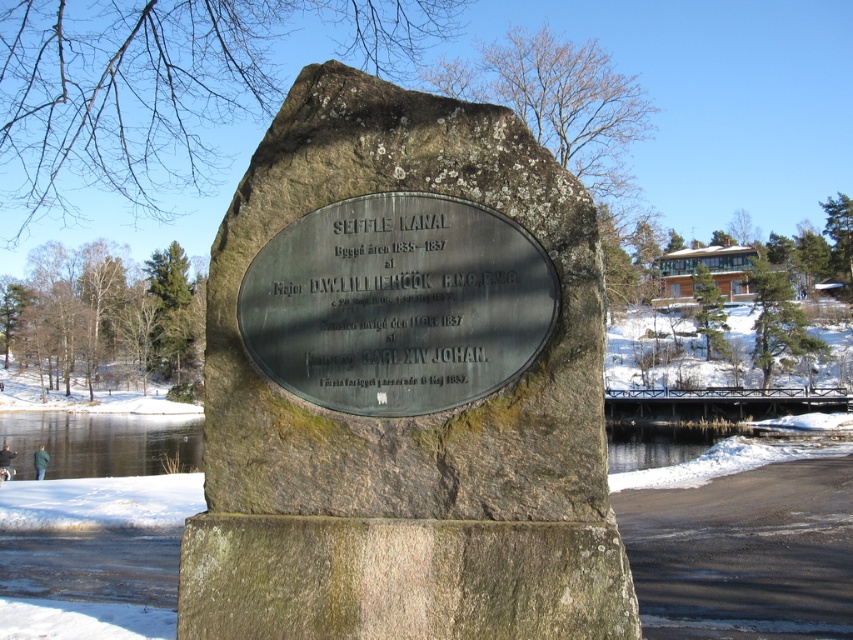
You are a visitor at the monument and want to take a photo of both the green mossy stone monument at center and the green polished stone plaque at center. Which object should you focus on first to ensure both are in frame?

You should focus on the green mossy stone monument at center first because it is taller than the green polished stone plaque at center, so positioning it properly will help ensure both fit in the frame.